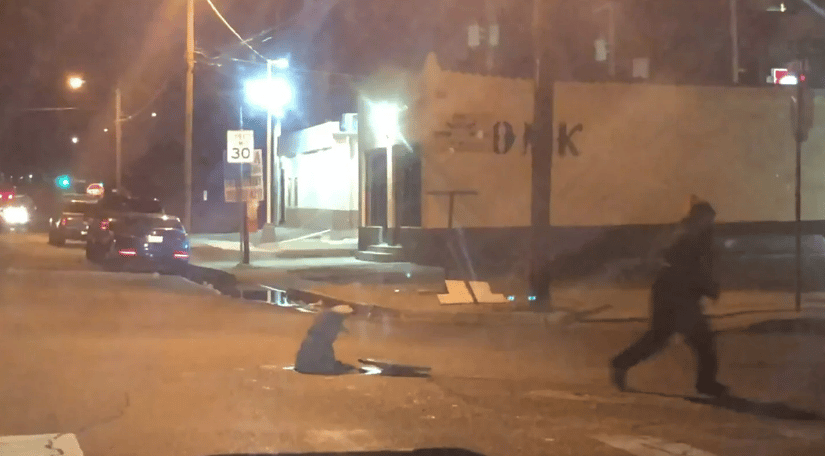
Where is `large white wall`? large white wall is located at coordinates (693, 157).